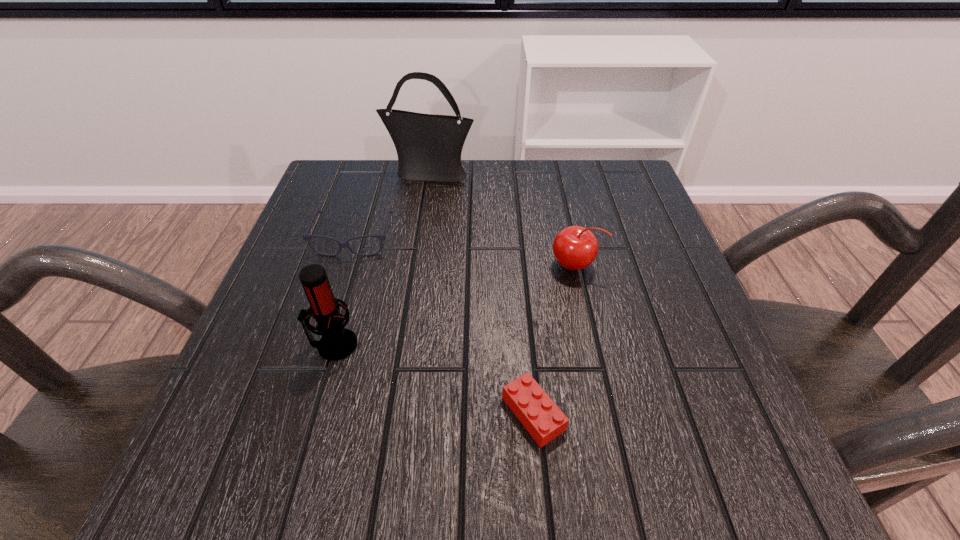
Identify the location of vacant area that satisfies the following two spatial constraints: 1. on the front-facing side of the third tallest object; 2. on the right side of the fourth tallest object. This screenshot has width=960, height=540. (345, 265).

You are a GUI agent. You are given a task and a screenshot of the screen. Output one action in this format:
    pyautogui.click(x=<x>, y=<y>)
    Task: Click on the vacant space that satisfies the following two spatial constraints: 1. on the front side of the tallest object; 2. on the right side of the second object from right to left
    
    Given the screenshot: What is the action you would take?
    tap(394, 414)

The image size is (960, 540). In order to click on free location that satisfies the following two spatial constraints: 1. on the front-facing side of the spectacles; 2. on the right side of the shortest object in this screenshot , I will do pyautogui.click(x=299, y=414).